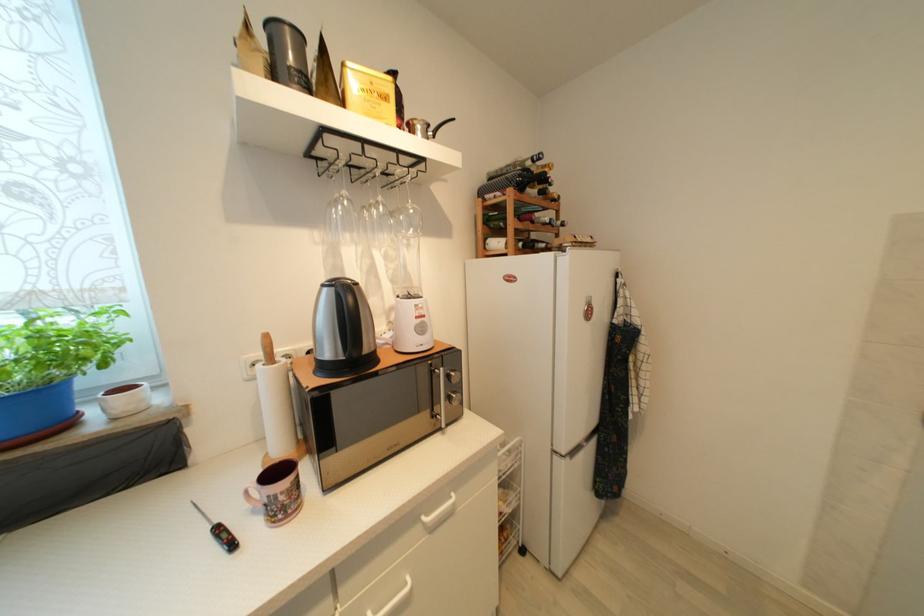
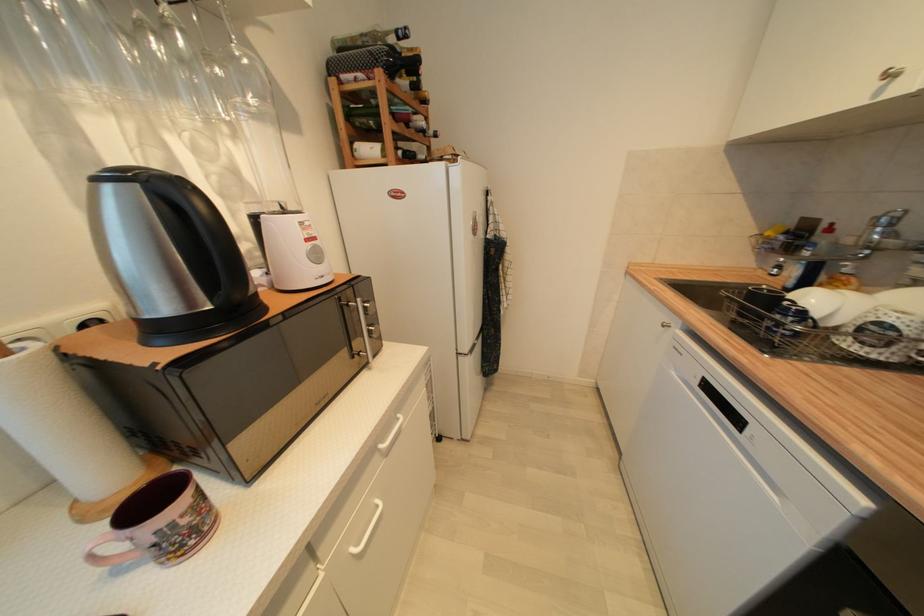
The images are taken continuously from a first-person perspective. In which direction is your viewpoint rotating?

The camera's rotation is toward right-down.